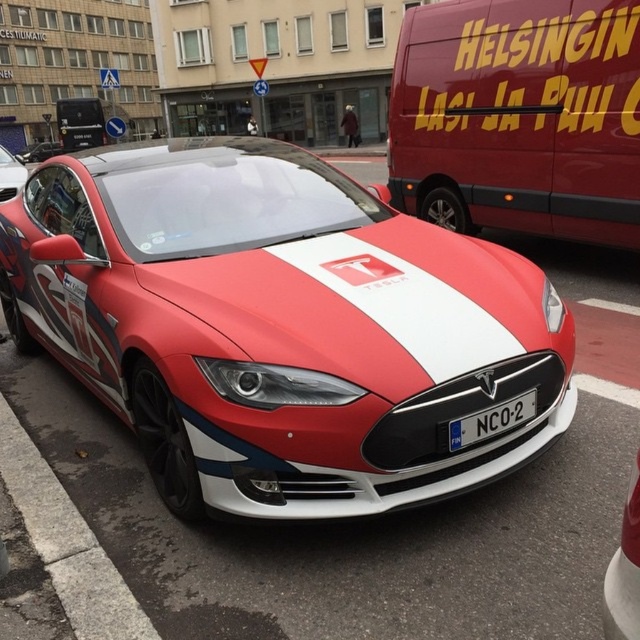
Looking at this image, you are a delivery driver who needs to park your truck next to the Tesla Model S. The parking space is only 2 meters wide. Can you safely park your truck next to the matte red van at upper right and the white plastic license plate at center without overlapping them?

The matte red van at upper right might be wider than the white plastic license plate at center. Since the parking space is 2 meters wide, it depends on the actual width of the matte red van at upper right. If it is wider than the license plate, there might not be enough space. Please check the exact width of the matte red van at upper right before deciding.

You are a delivery driver who needs to park your van near the matte red and white tesla at center. The parking spot is at coordinates point 0.512, 0.438. Can you safely park your van there without overlapping the Tesla?

The matte red and white tesla at center is already positioned at point (x=280, y=326), so parking your van there would overlap with the Tesla. Choose a different spot.